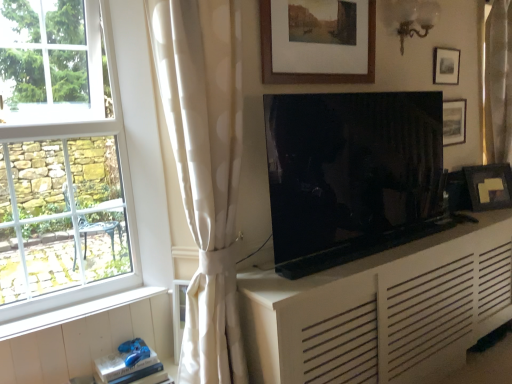
What are the coordinates of `empty space that is ontop of white wood at lower left (from a real-world perspective)` in the screenshot? It's located at (79, 304).